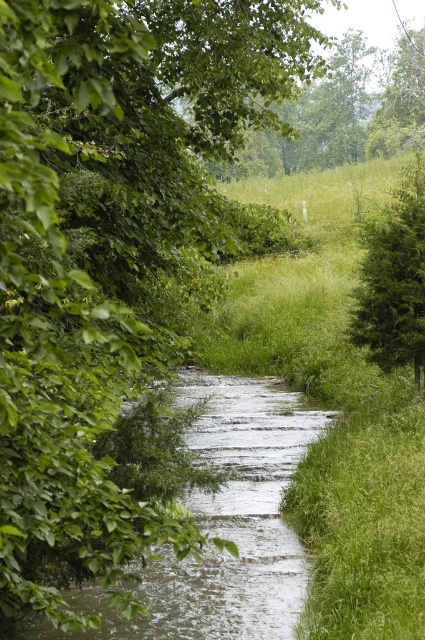
Is clear water at center to the left of green leafy tree at upper center from the viewer's perspective?

→ Yes, clear water at center is to the left of green leafy tree at upper center.

How far apart are clear water at center and green leafy tree at upper center?

A distance of 29.57 meters exists between clear water at center and green leafy tree at upper center.

At what (x,y) coordinates should I click in order to perform the action: click on clear water at center. Please return your answer as a coordinate pair (x, y). This screenshot has width=425, height=640. Looking at the image, I should click on (223, 524).

Which of these two, green leafy tree at upper center or green textured tree at right, stands shorter?

With less height is green textured tree at right.

Which is above, green leafy tree at upper center or green textured tree at right?

green leafy tree at upper center

You are a GUI agent. You are given a task and a screenshot of the screen. Output one action in this format:
    pyautogui.click(x=<x>, y=<y>)
    Task: Click on the green leafy tree at upper center
    The height and width of the screenshot is (640, 425).
    Given the screenshot: What is the action you would take?
    pyautogui.click(x=342, y=113)

Does clear water at center lie behind green textured tree at right?

No.

At what (x,y) coordinates should I click in order to perform the action: click on clear water at center. Please return your answer as a coordinate pair (x, y). Looking at the image, I should click on (223, 524).

The height and width of the screenshot is (640, 425). What are the coordinates of `clear water at center` in the screenshot? It's located at (223, 524).